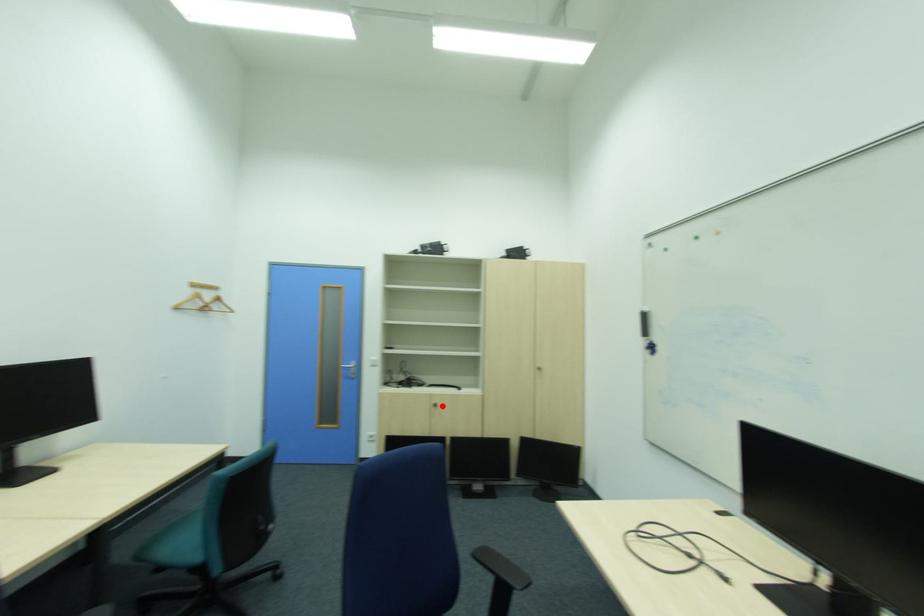
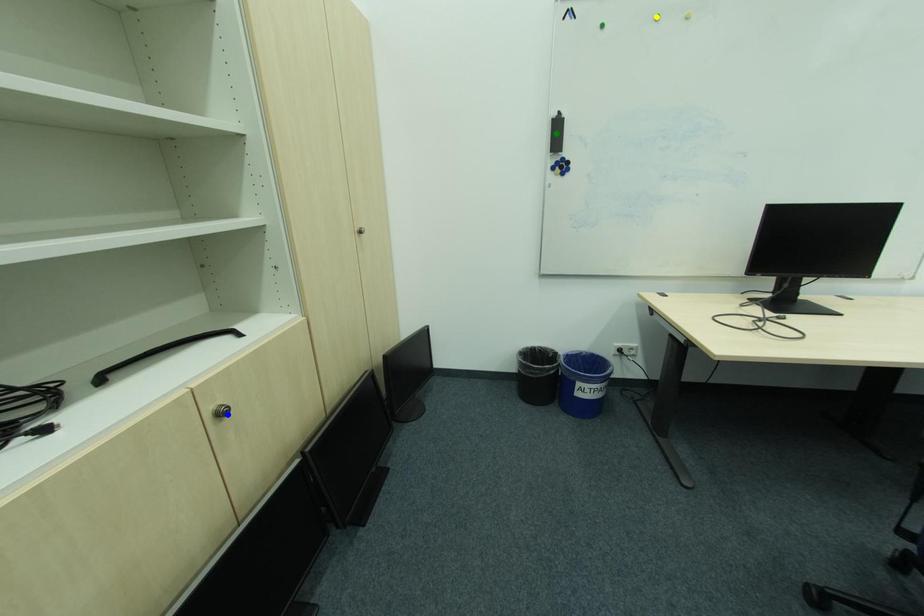
Question: I am providing you with two images of the same scene from different viewpoints. A red point is marked on the first image. You are given multiple points on the second image. In image 2, which mark is for the same physical point as the one in image 1?

Choices:
 (A) blue point
 (B) yellow point
 (C) green point

Answer: (A)